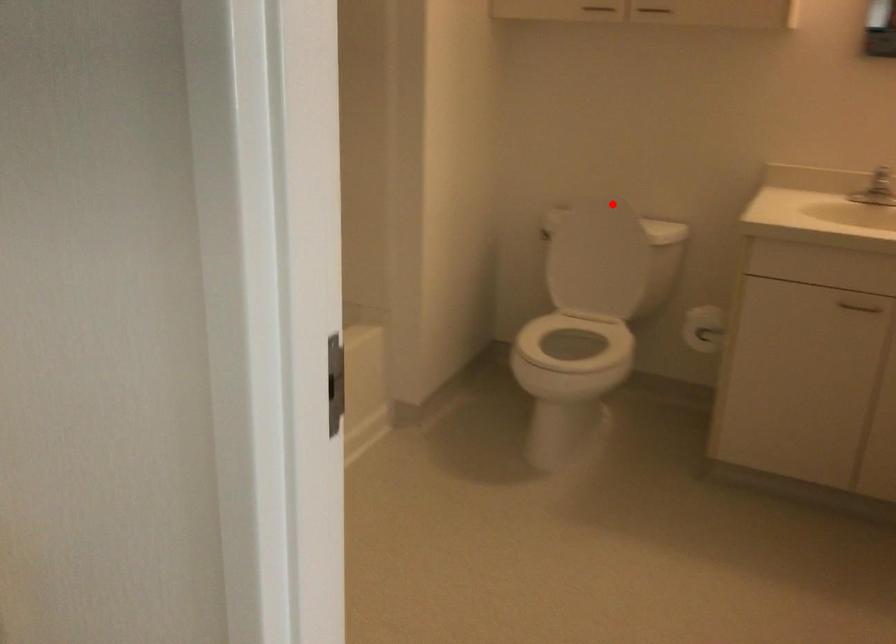
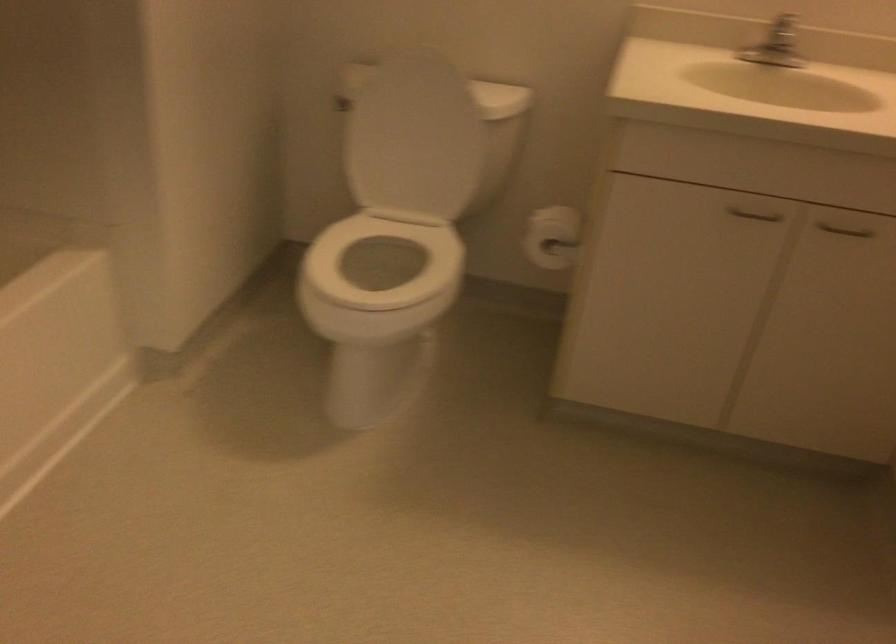
Locate, in the second image, the point that corresponds to the highlighted location in the first image.

(440, 61)